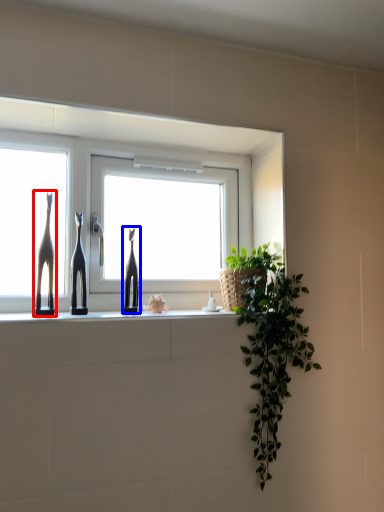
Question: Which of the following is the closest to the observer, giraffe (highlighted by a red box) or sculpture (highlighted by a blue box)?

Choices:
 (A) giraffe
 (B) sculpture

Answer: (A)